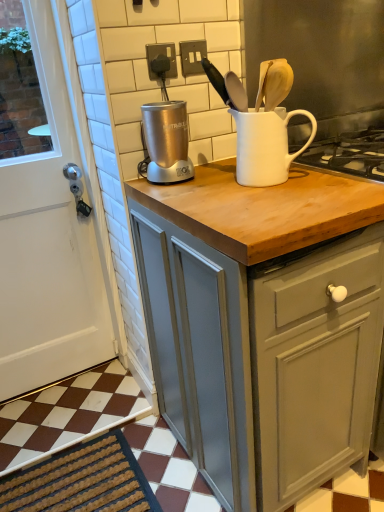
The width and height of the screenshot is (384, 512). Find the location of `vacant space to the right of satin silver blender at upper center`. vacant space to the right of satin silver blender at upper center is located at coordinates (214, 167).